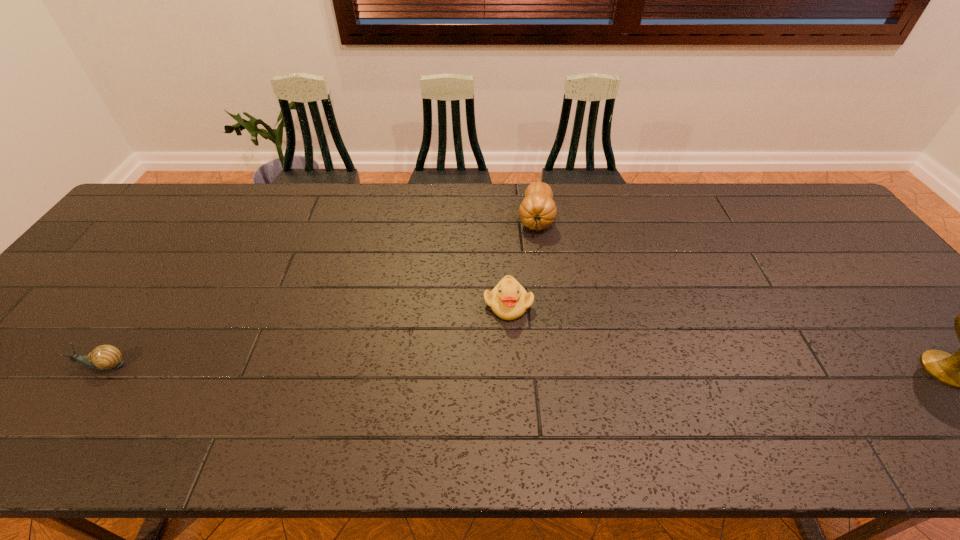
The width and height of the screenshot is (960, 540). I want to click on vacant space at the right edge of the desktop, so click(x=876, y=336).

Identify the location of blank region between the leftmost object and the duckling. (304, 334).

Locate an element on the screen. free spot between the duckling and the leftmost object is located at coordinates (304, 334).

Locate an element on the screen. This screenshot has width=960, height=540. the second closest object relative to the chalice is located at coordinates (509, 300).

In order to click on object that can be found as the second closest to the second shortest object in this screenshot , I will do `click(105, 357)`.